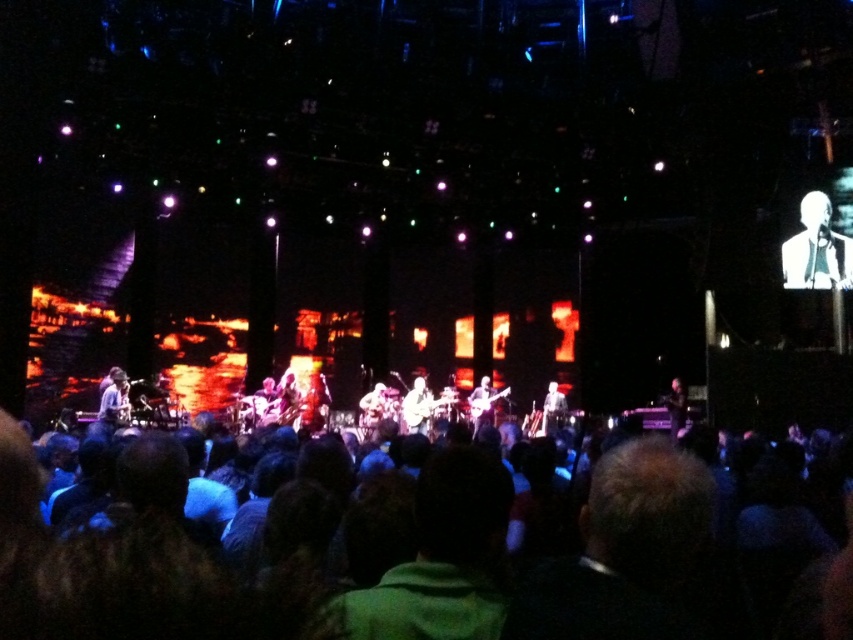
Is dark hair at center shorter than white suit at upper right?

Correct, dark hair at center is not as tall as white suit at upper right.

Describe the element at coordinates (126, 577) in the screenshot. I see `dark hair at center` at that location.

Where is `dark hair at center`? dark hair at center is located at coordinates click(126, 577).

Locate an element on the screen. The image size is (853, 640). dark hair at center is located at coordinates (126, 577).